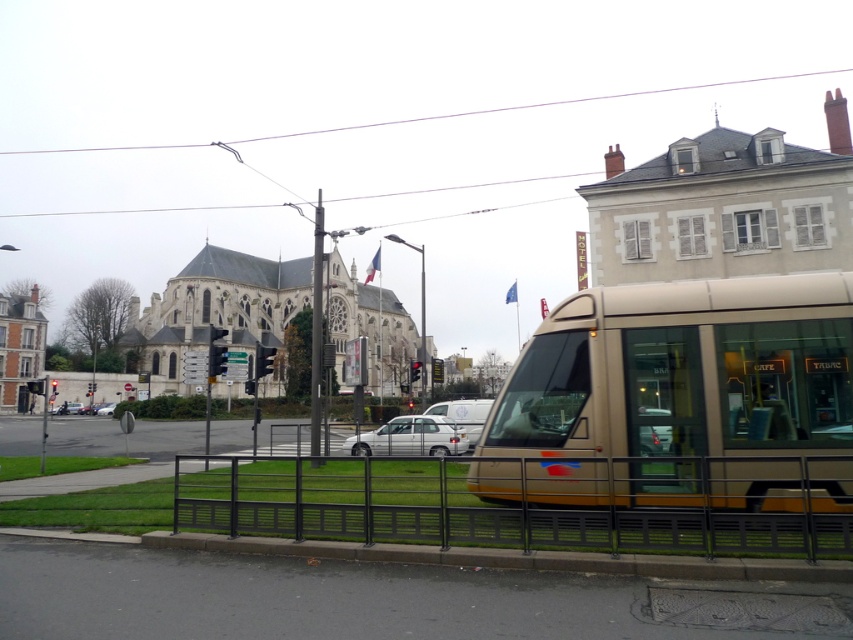
You are standing at the point marked by coordinates point (676, 394) in the image. What object are you directly at the center of?

The point (676, 394) marks the gold metallic tram at center, so you are directly at the center of the gold metallic tram at center.

You are standing at the point with coordinates point (802,477) and want to walk to point (355,445). Which direction should you move relative to the tram?

Since point (802,477) is in front of point (355,445), you should move backward relative to the tram to reach your destination.

You are standing at the center of the image and want to walk towards the metallic gray fence at lower center. In which direction should you move relative to the tram positioned on the right side of the frame?

The metallic gray fence at lower center is located at point coordinates that place it below and to the left of the tram. Since you are at the center, moving towards the lower left direction relative to the tram would lead you to the fence.